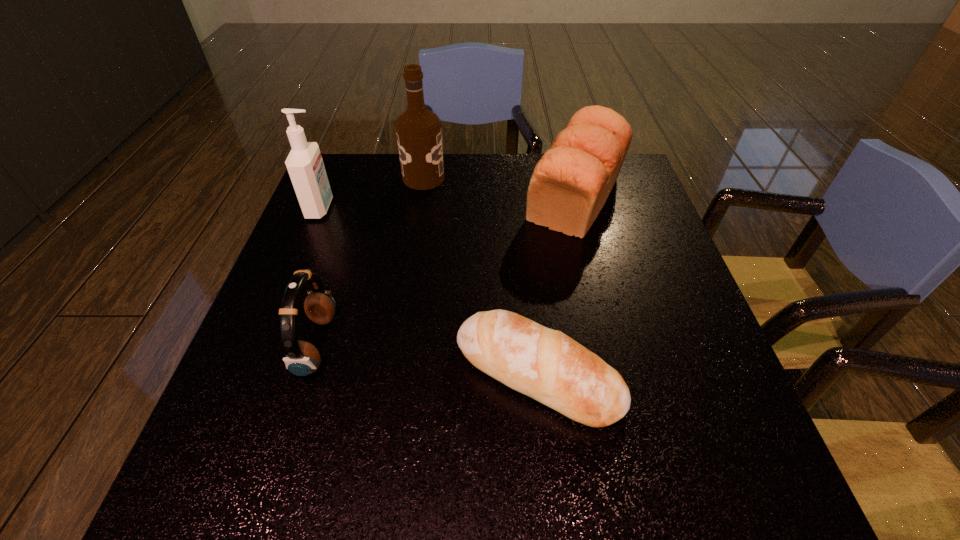
This screenshot has width=960, height=540. Identify the location of the third object from left to right. (418, 130).

Locate an element on the screen. the leftmost object is located at coordinates (305, 166).

Locate an element on the screen. The image size is (960, 540). the third shortest object is located at coordinates (570, 184).

You are a GUI agent. You are given a task and a screenshot of the screen. Output one action in this format:
    pyautogui.click(x=<x>, y=<y>)
    Task: Click on the taller bread
    This screenshot has width=960, height=540.
    Given the screenshot: What is the action you would take?
    pyautogui.click(x=570, y=184)

Where is `the second shortest object`? The height and width of the screenshot is (540, 960). the second shortest object is located at coordinates (302, 358).

Locate an element on the screen. the fourth object from right to left is located at coordinates (302, 358).

Identify the location of the shortest object. The height and width of the screenshot is (540, 960). (547, 365).

Identify the location of the shorter bread. This screenshot has height=540, width=960. (547, 365).

Image resolution: width=960 pixels, height=540 pixels. Find the location of `free spot located on the label of the third object from right to left`. free spot located on the label of the third object from right to left is located at coordinates (579, 178).

Locate an element on the screen. Image resolution: width=960 pixels, height=540 pixels. vacant space located 0.250m on the front label of the leftmost object is located at coordinates (425, 208).